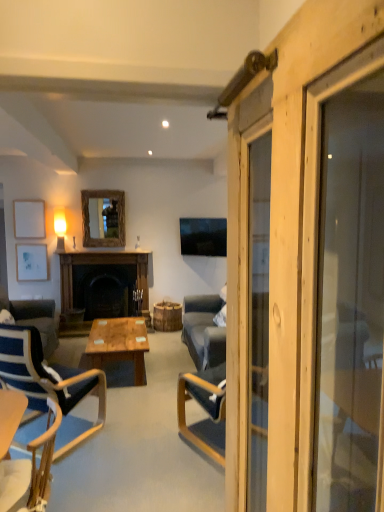
The height and width of the screenshot is (512, 384). What are the coordinates of `wooden frame mirror at upper center` in the screenshot? It's located at (103, 218).

The image size is (384, 512). Identify the location of white matte picture frame at upper left, the 1th picture frame from the top. (29, 219).

The height and width of the screenshot is (512, 384). I want to click on blue fabric chair at left, which is the 1th chair in back-to-front order, so (47, 379).

Describe the element at coordinates (47, 379) in the screenshot. This screenshot has width=384, height=512. I see `blue fabric chair at left, which is the 1th chair in back-to-front order` at that location.

At what (x,y) coordinates should I click in order to perform the action: click on white matte picture frame at left, the 1th picture frame ordered from the bottom. Please return your answer as a coordinate pair (x, y). Looking at the image, I should click on (32, 262).

I want to click on wooden frame mirror at upper center, so click(103, 218).

Visually, is white matte picture frame at left, positioned as the second picture frame in top-to-bottom order, positioned to the left or to the right of wooden frame mirror at upper center?

From the image, it's evident that white matte picture frame at left, positioned as the second picture frame in top-to-bottom order, is to the left of wooden frame mirror at upper center.

Can you tell me how much white matte picture frame at left, positioned as the second picture frame in top-to-bottom order, and wooden frame mirror at upper center differ in facing direction?

The facing directions of white matte picture frame at left, positioned as the second picture frame in top-to-bottom order, and wooden frame mirror at upper center are 0.00169 degrees apart.

What are the coordinates of `the 2nd picture frame directly beneath the wooden frame mirror at upper center (from a real-world perspective)` in the screenshot? It's located at (32, 262).

Locate an element on the screen. the 1st chair below the wooden barn door at right (from a real-world perspective) is located at coordinates (47, 379).

Can blue fabric chair at left, which is the 1th chair in back-to-front order, be found inside wooden barn door at right?

No, blue fabric chair at left, which is the 1th chair in back-to-front order, is not surrounded by wooden barn door at right.

Is wooden barn door at right smaller than blue fabric chair at left, which appears as the second chair when viewed from the front?

Correct, wooden barn door at right occupies less space than blue fabric chair at left, which appears as the second chair when viewed from the front.

Which object is wider, wooden barn door at right or blue fabric chair at left, which appears as the second chair when viewed from the front?

blue fabric chair at left, which appears as the second chair when viewed from the front, is wider.

What's the angular difference between blue fabric chair at left, which is the 1th chair in back-to-front order, and white matte picture frame at upper left, acting as the 2th picture frame starting from the bottom,'s facing directions?

There is a 145-degree angle between the facing directions of blue fabric chair at left, which is the 1th chair in back-to-front order, and white matte picture frame at upper left, acting as the 2th picture frame starting from the bottom.

Where is `the 2nd picture frame to the left of the blue fabric chair at left, which appears as the second chair when viewed from the front, starting your count from the anchor`? The height and width of the screenshot is (512, 384). the 2nd picture frame to the left of the blue fabric chair at left, which appears as the second chair when viewed from the front, starting your count from the anchor is located at coordinates (29, 219).

From the picture: Considering the positions of objects blue fabric chair at left, which appears as the second chair when viewed from the front, and white matte picture frame at upper left, acting as the 2th picture frame starting from the bottom, in the image provided, who is more to the right, blue fabric chair at left, which appears as the second chair when viewed from the front, or white matte picture frame at upper left, acting as the 2th picture frame starting from the bottom,?

blue fabric chair at left, which appears as the second chair when viewed from the front.

Based on the photo, from the image's perspective, is blue fabric chair at left, which appears as the second chair when viewed from the front, located above or below white matte picture frame at upper left, acting as the 2th picture frame starting from the bottom?

blue fabric chair at left, which appears as the second chair when viewed from the front, is situated lower than white matte picture frame at upper left, acting as the 2th picture frame starting from the bottom, in the image.

Are wooden frame mirror at upper center and wooden barn door at right beside each other?

wooden frame mirror at upper center and wooden barn door at right are not in contact.

What's the angular difference between wooden frame mirror at upper center and wooden barn door at right's facing directions?

89.8 degrees separate the facing orientations of wooden frame mirror at upper center and wooden barn door at right.

In the image, there is a wooden barn door at right. At what (x,y) coordinates should I click in order to perform the action: click on mirror above it (from the image's perspective). Please return your answer as a coordinate pair (x, y). Looking at the image, I should click on (103, 218).

Which object is closer to the camera taking this photo, wooden frame mirror at upper center or wooden barn door at right?

wooden barn door at right is more forward.

Is wooden polished coffee table at center looking in the opposite direction of blue fabric chair at left, which appears as the second chair when viewed from the front?

wooden polished coffee table at center is not turned away from blue fabric chair at left, which appears as the second chair when viewed from the front.

Which of these two, wooden polished coffee table at center or blue fabric chair at left, which appears as the second chair when viewed from the front, is smaller?

wooden polished coffee table at center is smaller.

Considering the sizes of objects wooden polished coffee table at center and blue fabric chair at left, which appears as the second chair when viewed from the front, in the image provided, who is thinner, wooden polished coffee table at center or blue fabric chair at left, which appears as the second chair when viewed from the front,?

wooden polished coffee table at center.

From the picture: What's the angular difference between wooden polished coffee table at center and blue fabric chair at left, which appears as the second chair when viewed from the front,'s facing directions?

55.4 degrees separate the facing orientations of wooden polished coffee table at center and blue fabric chair at left, which appears as the second chair when viewed from the front.

Is white matte picture frame at left, positioned as the second picture frame in top-to-bottom order, taller than wooden barn door at right?

No.

Is wooden barn door at right surrounded by white matte picture frame at left, the 1th picture frame ordered from the bottom?

No, wooden barn door at right is located outside of white matte picture frame at left, the 1th picture frame ordered from the bottom.

Which of these two, white matte picture frame at left, positioned as the second picture frame in top-to-bottom order, or wooden barn door at right, is wider?

wooden barn door at right is wider.

Which is more to the left, white matte picture frame at left, the 1th picture frame ordered from the bottom, or wooden barn door at right?

white matte picture frame at left, the 1th picture frame ordered from the bottom.

Identify the location of chair that is the 2nd one below the white matte picture frame at upper left, the 1th picture frame from the top (from a real-world perspective). Image resolution: width=384 pixels, height=512 pixels. (30, 470).

Is wooden chair at lower left, the 2th chair from the back, outside of white matte picture frame at upper left, acting as the 2th picture frame starting from the bottom?

That's correct, wooden chair at lower left, the 2th chair from the back, is outside of white matte picture frame at upper left, acting as the 2th picture frame starting from the bottom.

Is wooden chair at lower left, the 2th chair from the back, taller than white matte picture frame at upper left, acting as the 2th picture frame starting from the bottom?

Yes, wooden chair at lower left, the 2th chair from the back, is taller than white matte picture frame at upper left, acting as the 2th picture frame starting from the bottom.

How different are the orientations of wooden chair at lower left, the 2th chair from the back, and white matte picture frame at upper left, the 1th picture frame from the top, in degrees?

88.5 degrees separate the facing orientations of wooden chair at lower left, the 2th chair from the back, and white matte picture frame at upper left, the 1th picture frame from the top.

Identify the location of mirror on the right of white matte picture frame at left, the 1th picture frame ordered from the bottom. (103, 218).

Where is `barn door positioned vertically above the blue fabric chair at left, which appears as the second chair when viewed from the front (from a real-world perspective)`? This screenshot has width=384, height=512. barn door positioned vertically above the blue fabric chair at left, which appears as the second chair when viewed from the front (from a real-world perspective) is located at coordinates (279, 231).

From the image, which object appears to be nearer to white matte picture frame at left, positioned as the second picture frame in top-to-bottom order, wooden chair at lower left, the first chair from the front, or blue fabric chair at left, which is the 1th chair in back-to-front order?

Among the two, blue fabric chair at left, which is the 1th chair in back-to-front order, is located nearer to white matte picture frame at left, positioned as the second picture frame in top-to-bottom order.

Looking at the image, which one is located further to white matte picture frame at upper left, the 1th picture frame from the top, dark stone fireplace at center or wooden chair at lower left, the first chair from the front?

wooden chair at lower left, the first chair from the front, lies further to white matte picture frame at upper left, the 1th picture frame from the top, than the other object.

In the scene shown: Based on their spatial positions, is white matte picture frame at left, the 1th picture frame ordered from the bottom, or wooden chair at lower left, the 2th chair from the back, closer to wooden frame mirror at upper center?

The object closer to wooden frame mirror at upper center is white matte picture frame at left, the 1th picture frame ordered from the bottom.

Based on their spatial positions, is wooden polished coffee table at center or wooden barn door at right further from blue fabric chair at left, which is the 1th chair in back-to-front order?

The object further to blue fabric chair at left, which is the 1th chair in back-to-front order, is wooden barn door at right.

Which object lies further to the anchor point dark stone fireplace at center, wooden chair at lower left, the first chair from the front, or white matte picture frame at left, positioned as the second picture frame in top-to-bottom order?

Based on the image, wooden chair at lower left, the first chair from the front, appears to be further to dark stone fireplace at center.

Estimate the real-world distances between objects in this image. Which object is further from wooden barn door at right, wooden frame mirror at upper center or blue fabric chair at left, which is the 1th chair in back-to-front order?

The object further to wooden barn door at right is wooden frame mirror at upper center.

Based on their spatial positions, is dark stone fireplace at center or white matte picture frame at left, the 1th picture frame ordered from the bottom, closer to wooden barn door at right?

dark stone fireplace at center lies closer to wooden barn door at right than the other object.

From the image, which object appears to be nearer to wooden frame mirror at upper center, wooden polished coffee table at center or white matte picture frame at upper left, the 1th picture frame from the top?

white matte picture frame at upper left, the 1th picture frame from the top, is positioned closer to the anchor wooden frame mirror at upper center.

Locate an element on the screen. The height and width of the screenshot is (512, 384). coffee table between blue fabric chair at left, which appears as the second chair when viewed from the front, and white matte picture frame at upper left, acting as the 2th picture frame starting from the bottom, from front to back is located at coordinates (118, 350).

Find the location of `coffee table located between wooden barn door at right and wooden frame mirror at upper center in the depth direction`. coffee table located between wooden barn door at right and wooden frame mirror at upper center in the depth direction is located at coordinates (118, 350).

At what (x,y) coordinates should I click in order to perform the action: click on chair between wooden chair at lower left, the first chair from the front, and wooden polished coffee table at center from front to back. Please return your answer as a coordinate pair (x, y). This screenshot has height=512, width=384. Looking at the image, I should click on (47, 379).

Find the location of a particular element. The width and height of the screenshot is (384, 512). chair between wooden barn door at right and blue fabric chair at left, which appears as the second chair when viewed from the front, in the front-back direction is located at coordinates (30, 470).